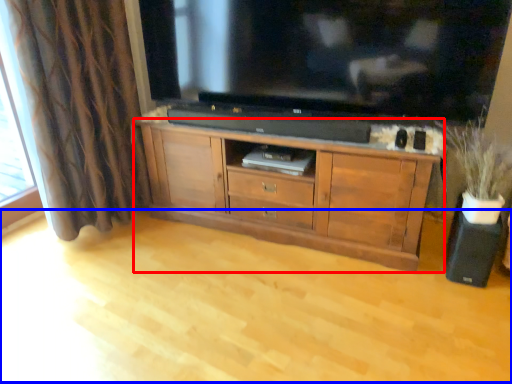
Question: Which object is further to the camera taking this photo, cabinetry (highlighted by a red box) or plain (highlighted by a blue box)?

Choices:
 (A) cabinetry
 (B) plain

Answer: (A)